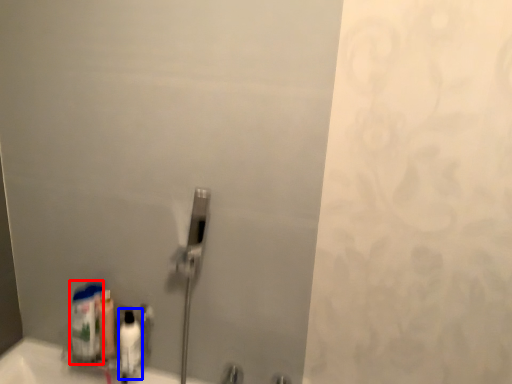
Question: Which point is further to the camera, cleaning product (highlighted by a red box) or mouthwash (highlighted by a blue box)?

Choices:
 (A) cleaning product
 (B) mouthwash

Answer: (A)